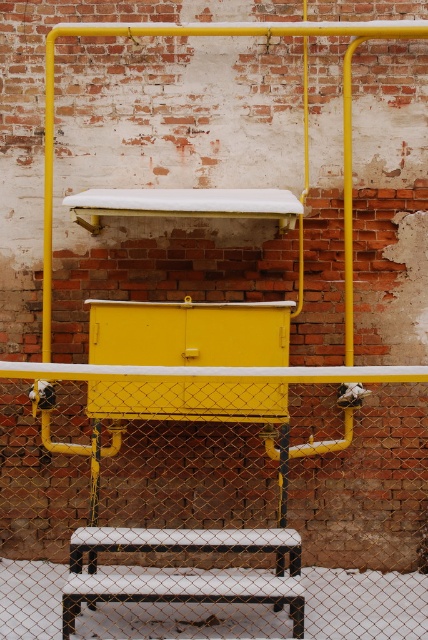
Question: Can you confirm if metal chain-link fence at center is smaller than white plastic stool at lower center?

Choices:
 (A) yes
 (B) no

Answer: (B)

Question: Which of the following is the farthest from the observer?

Choices:
 (A) (359, 515)
 (B) (256, 589)

Answer: (A)

Question: Considering the relative positions of metal chain-link fence at center and white plastic stool at lower center in the image provided, where is metal chain-link fence at center located with respect to white plastic stool at lower center?

Choices:
 (A) right
 (B) left

Answer: (A)

Question: Which object is farther from the camera taking this photo?

Choices:
 (A) white plastic stool at lower center
 (B) metal chain-link fence at center

Answer: (B)

Question: Which point is closer to the camera?

Choices:
 (A) metal chain-link fence at center
 (B) white plastic stool at lower center

Answer: (B)

Question: Is metal chain-link fence at center positioned at the back of white plastic stool at lower center?

Choices:
 (A) no
 (B) yes

Answer: (B)